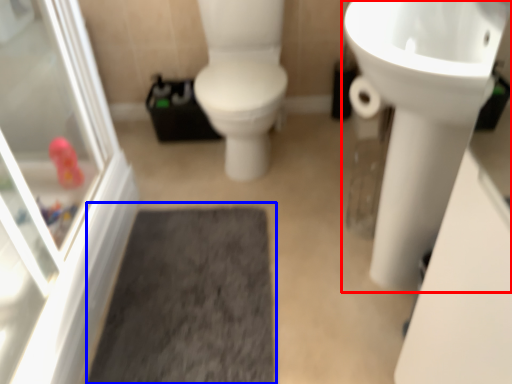
Question: Which object appears farthest to the camera in this image, sink (highlighted by a red box) or bath mat (highlighted by a blue box)?

Choices:
 (A) sink
 (B) bath mat

Answer: (B)